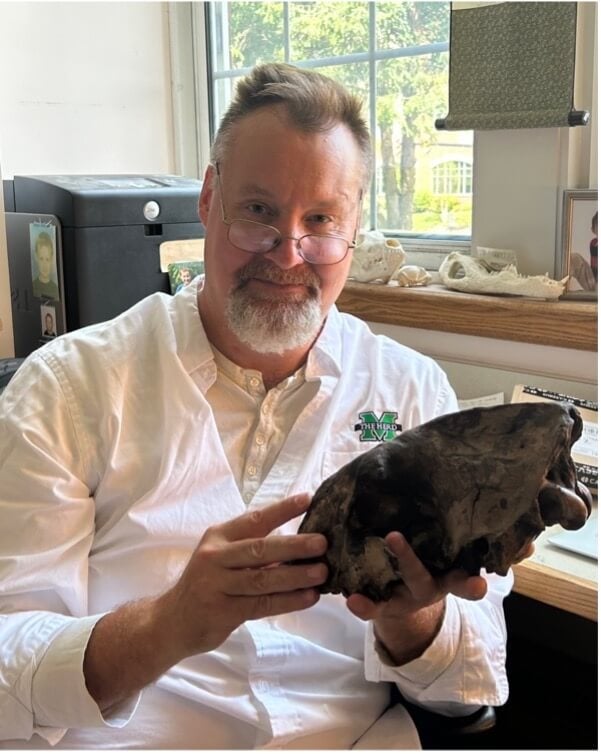
Where is `book`? The image size is (601, 754). book is located at coordinates (589, 470).